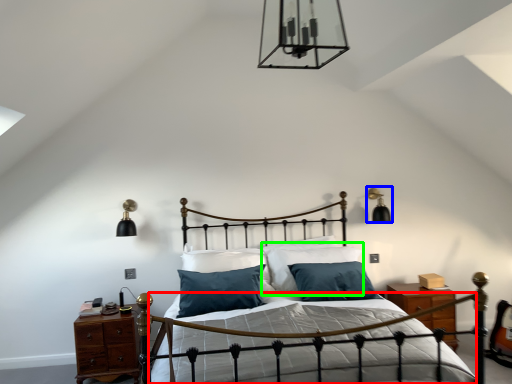
Question: Which is nearer to the bed frame (highlighted by a red box)? light fixture (highlighted by a blue box) or pillow (highlighted by a green box).

Choices:
 (A) light fixture
 (B) pillow

Answer: (B)